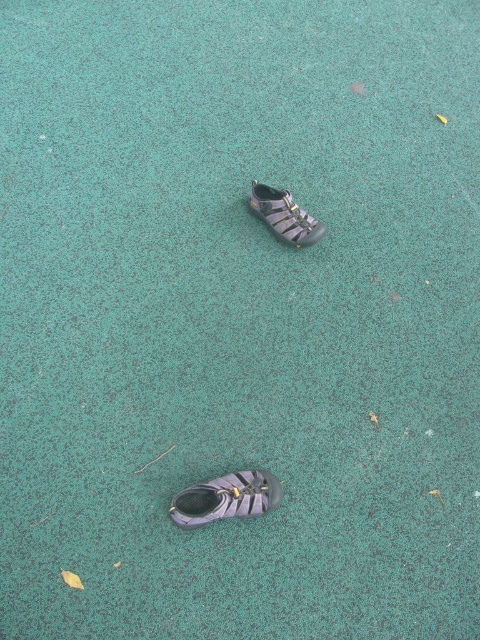
Which is behind, point (224, 486) or point (303, 218)?

Point (303, 218)

At what (x,y) coordinates should I click in order to perform the action: click on purple fabric sandal at lower center. Please return your answer as a coordinate pair (x, y). The height and width of the screenshot is (640, 480). Looking at the image, I should click on (227, 499).